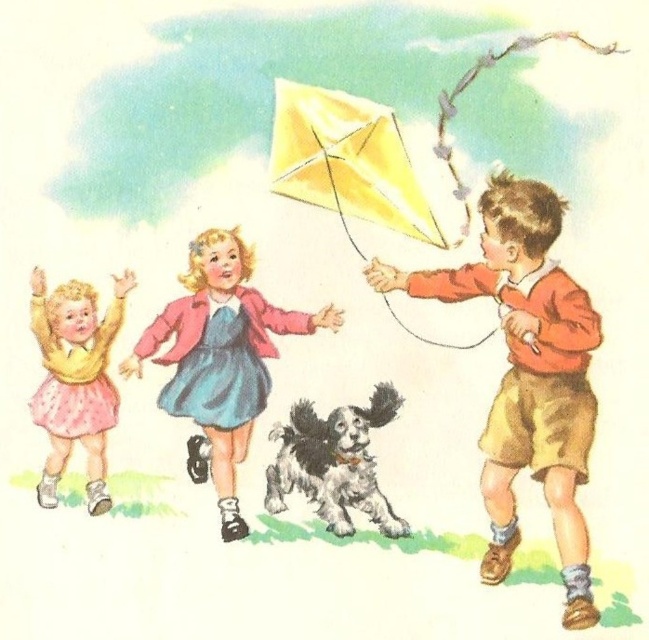
You are a photographer trying to capture a photo of the matte pink dress at center and the yellow paper kite at upper center. Which object should you focus on first if you want to ensure both are in focus without adjusting the camera settings?

The matte pink dress at center is taller than the yellow paper kite at upper center, so focusing on the matte pink dress at center first would help ensure both are in focus since it is larger and closer to the camera.

You are a fashion designer observing the children in the scene. You need to decide which item of clothing requires more fabric to produce between the matte orange sweater at right and the pink matte skirt at lower left. Which one?

The matte orange sweater at right is larger in size than the pink matte skirt at lower left, so it requires more fabric to produce.

Looking at this image, based on the scene described, which object is taller between the matte orange sweater at right and the pink matte skirt at lower left?

The matte orange sweater at right is taller than the pink matte skirt at lower left.